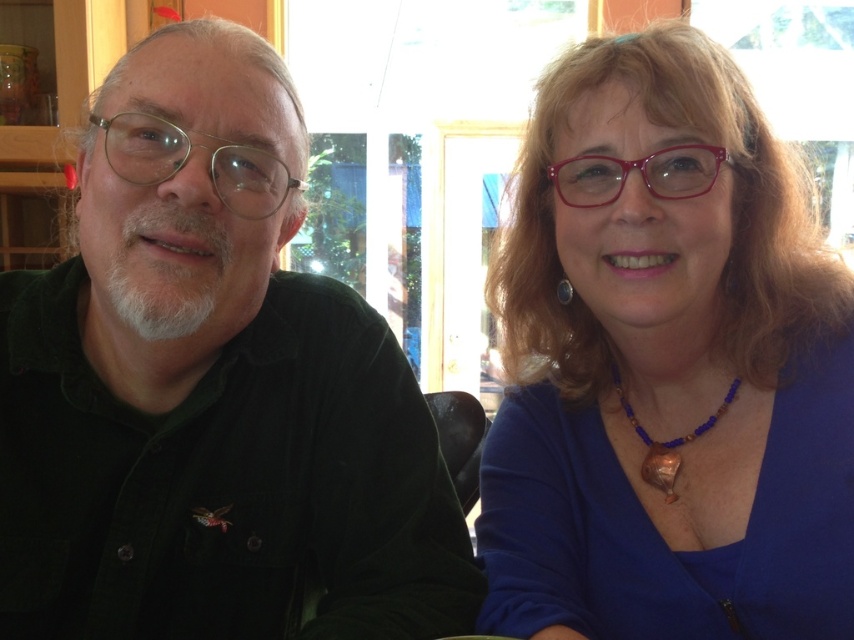
Is point (363, 328) farther from camera compared to point (611, 189)?

Yes, point (363, 328) is farther from viewer.

Between dark green corduroy shirt at left and blue fabric shirt at upper right, which one appears on the right side from the viewer's perspective?

From the viewer's perspective, blue fabric shirt at upper right appears more on the right side.

Measure the distance between dark green corduroy shirt at left and camera.

dark green corduroy shirt at left and camera are 32.13 inches apart.

Identify the location of dark green corduroy shirt at left. This screenshot has height=640, width=854. [211, 388].